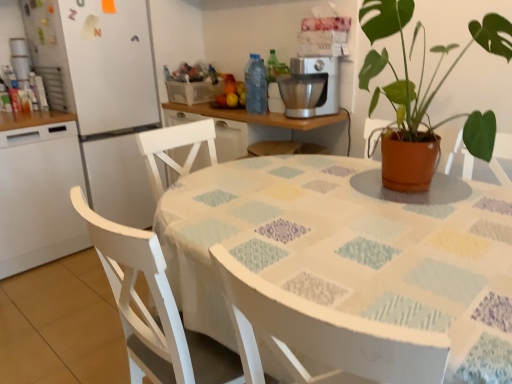
Question: Does white matte refrigerator at left have a lesser height compared to white glossy refrigerator at left?

Choices:
 (A) yes
 (B) no

Answer: (B)

Question: Would you say white matte refrigerator at left contains white glossy refrigerator at left?

Choices:
 (A) no
 (B) yes

Answer: (A)

Question: Can you confirm if white matte refrigerator at left is positioned to the left of white glossy refrigerator at left?

Choices:
 (A) no
 (B) yes

Answer: (A)

Question: Is white matte refrigerator at left in front of white glossy refrigerator at left?

Choices:
 (A) no
 (B) yes

Answer: (A)

Question: Would you consider white matte refrigerator at left to be distant from white glossy refrigerator at left?

Choices:
 (A) no
 (B) yes

Answer: (A)

Question: Is the depth of white matte refrigerator at left greater than that of white glossy refrigerator at left?

Choices:
 (A) no
 (B) yes

Answer: (B)

Question: Is terracotta pot at upper right surrounded by white glossy refrigerator at left?

Choices:
 (A) no
 (B) yes

Answer: (A)

Question: From a real-world perspective, is white glossy refrigerator at left on top of terracotta pot at upper right?

Choices:
 (A) no
 (B) yes

Answer: (A)

Question: Is white glossy refrigerator at left completely or partially outside of terracotta pot at upper right?

Choices:
 (A) yes
 (B) no

Answer: (A)

Question: Is white glossy refrigerator at left at the left side of terracotta pot at upper right?

Choices:
 (A) yes
 (B) no

Answer: (A)

Question: Does white glossy refrigerator at left come in front of terracotta pot at upper right?

Choices:
 (A) no
 (B) yes

Answer: (A)

Question: Considering the relative sizes of white glossy refrigerator at left and terracotta pot at upper right in the image provided, is white glossy refrigerator at left taller than terracotta pot at upper right?

Choices:
 (A) yes
 (B) no

Answer: (A)

Question: Is the depth of transparent plastic bottle at center greater than that of white glossy refrigerator at left?

Choices:
 (A) no
 (B) yes

Answer: (B)